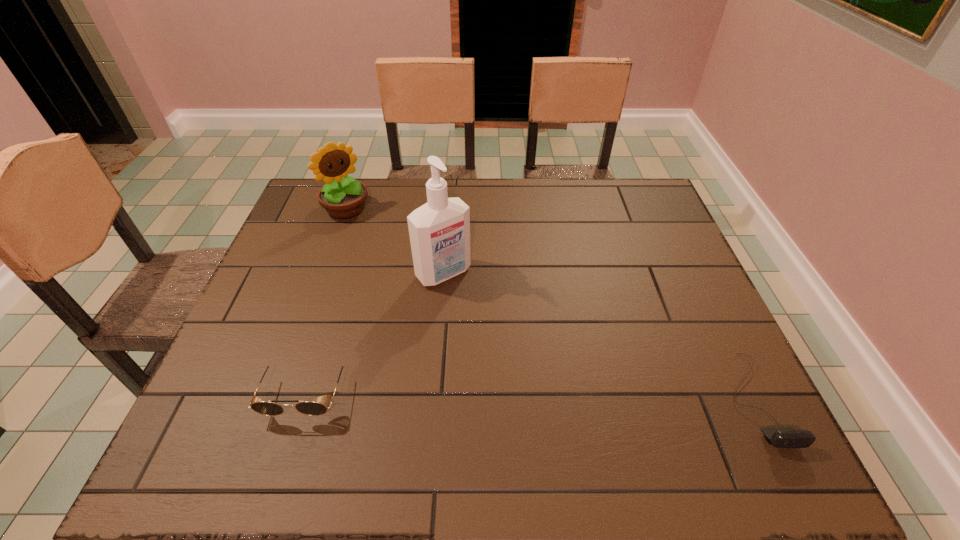
This screenshot has height=540, width=960. Identify the location of object that is the closest to the second object from right to left. (343, 197).